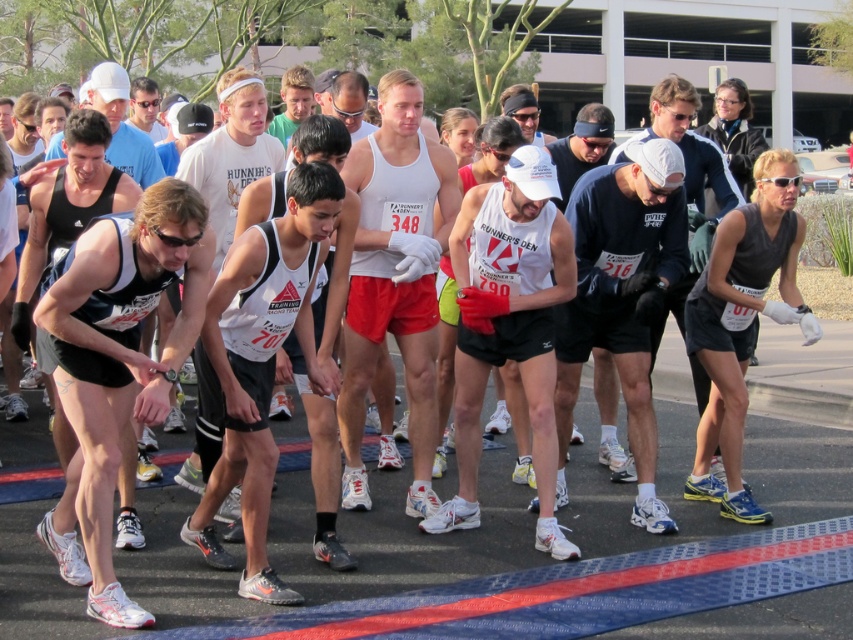
You are a photographer at the starting line of the race. You need to capture a photo where the white matte tank top at center and the matte black tank top at center are both visible. Based on their heights, which runner should you focus on to ensure both are in frame?

The white matte tank top at center is taller than the matte black tank top at center. To ensure both are visible in the photo, focus on the white matte tank top at center as the taller runner will naturally be in the frame when capturing the shorter one.

You are a photographer at the race starting line. You need to capture a photo of the white matte tank top at center and the matte black tank top at center. Which one is positioned lower in the frame?

The white matte tank top at center is located below the matte black tank top at center, so it is positioned lower in the frame.

You are a photographer at the race starting line. You need to capture a photo of the dark blue fabric shirt at center. Where should you aim your camera?

The dark blue fabric shirt at center is located at point (x=621, y=298), so you should aim your camera at those coordinates to capture it.